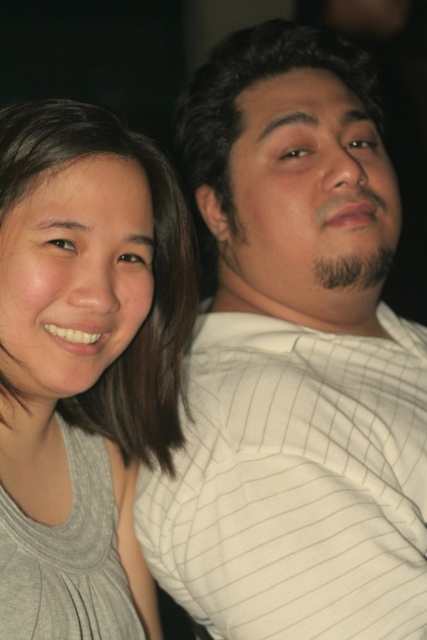
Does white striped shirt at upper right come behind gray matte tank top at left?

Yes, it is.

In the scene shown: Who is lower down, white striped shirt at upper right or gray matte tank top at left?

gray matte tank top at left

Who is more distant from viewer, [202,68] or [11,186]?

The point [202,68] is more distant.

Locate an element on the screen. white striped shirt at upper right is located at coordinates (295, 362).